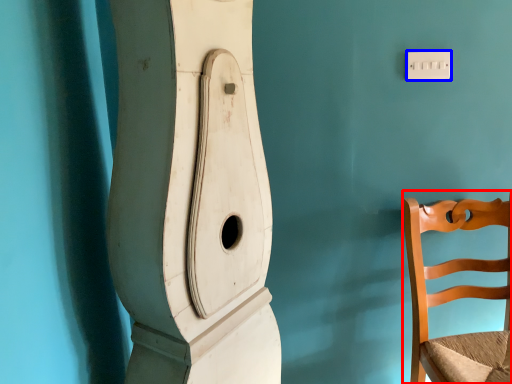
Question: Which object is further to the camera taking this photo, chair (highlighted by a red box) or light switch (highlighted by a blue box)?

Choices:
 (A) chair
 (B) light switch

Answer: (B)